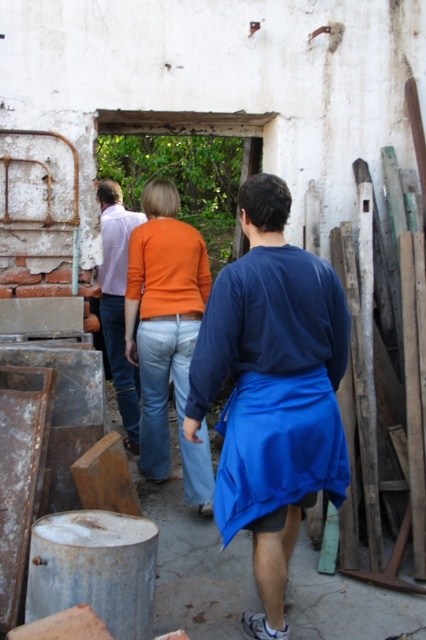
You are standing in front of the doorway leading to the green area and see the blue fabric apron at center and the matte purple shirt at center. Which clothing item is nearer to you?

The blue fabric apron at center is closer to the viewer than the matte purple shirt at center, so the blue fabric apron at center is nearer to you.

You are a photographer trying to capture a group photo of the orange cotton shirt at center and the matte purple shirt at center. Since you want to ensure both are clearly visible, which person should you position closer to the camera to avoid being obscured?

The orange cotton shirt at center has a larger width than the matte purple shirt at center, so positioning the orange cotton shirt at center closer to the camera will help prevent it from being obscured by the matte purple shirt at center.

You are standing at the entrance of the old building and need to hand a tool to the person wearing the blue fabric apron at center without getting too close. The tool must be placed within 5 feet of them. Can you safely do this by placing it near the matte purple shirt at center?

The blue fabric apron at center is 7.53 feet from the matte purple shirt at center. Since the required distance is 5 feet, placing the tool near the matte purple shirt at center would be 7.53 feet away from the apron wearer, which is beyond the 5 feet limit. Therefore, you cannot safely place the tool within 5 feet of the blue fabric apron at center by using that location.